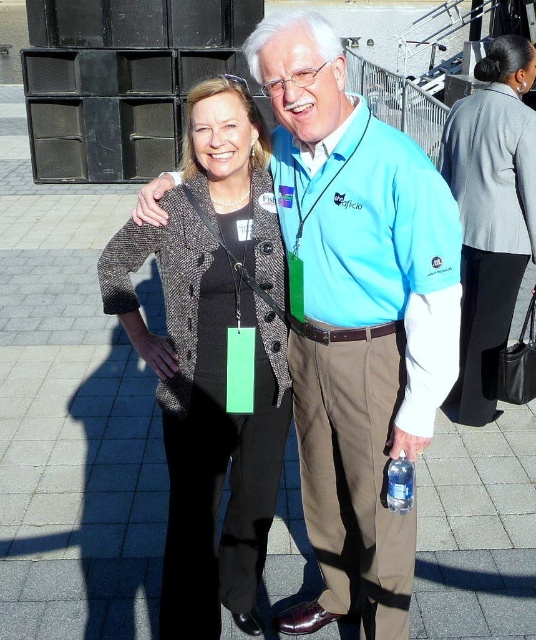
You are a fashion designer observing two blazers in the image. The textured tweed blazer at center and the gray wool blazer at upper right. Which blazer has a shorter length?

The textured tweed blazer at center is shorter than the gray wool blazer at upper right.

What is the 2D coordinate of the textured tweed blazer at center?

The 2D coordinate of the textured tweed blazer at center is at point (212, 358).

You are a photographer setting up for an outdoor event. You notice two blazers in the scene. The textured tweed blazer at center and the gray wool blazer at upper right. Which blazer is closer to the camera?

The textured tweed blazer at center is closer to the camera because it is in front of the gray wool blazer at upper right.